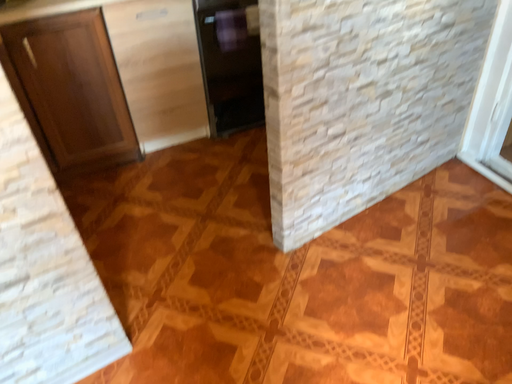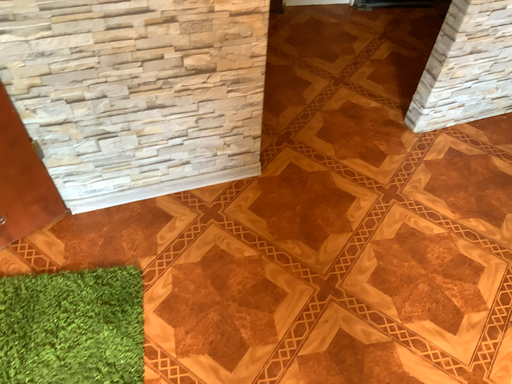
Question: Which way did the camera rotate in the video?

Choices:
 (A) rotated left
 (B) rotated right

Answer: (A)